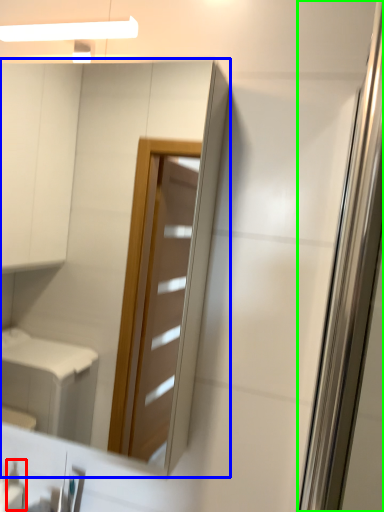
Question: Which is nearer to the toiletry (highlighted by a red box)? mirror (highlighted by a blue box) or screen door (highlighted by a green box).

Choices:
 (A) mirror
 (B) screen door

Answer: (B)